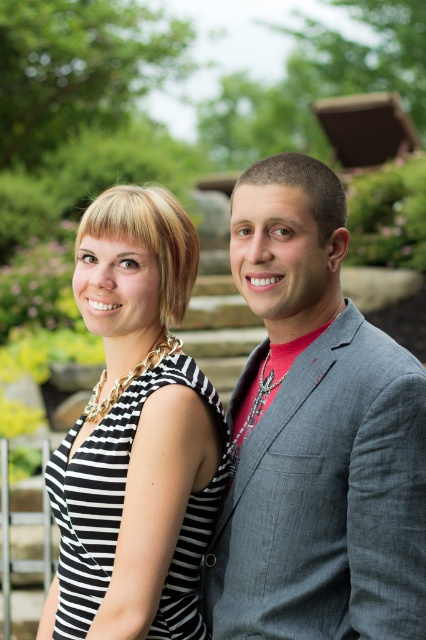
Between gray textured blazer at right and black striped fabric dress at center, which one has less height?

Standing shorter between the two is black striped fabric dress at center.

Consider the image. Can you confirm if gray textured blazer at right is bigger than black striped fabric dress at center?

Yes, gray textured blazer at right is bigger than black striped fabric dress at center.

Locate an element on the screen. This screenshot has height=640, width=426. gray textured blazer at right is located at coordinates (316, 435).

Locate an element on the screen. gray textured blazer at right is located at coordinates (316, 435).